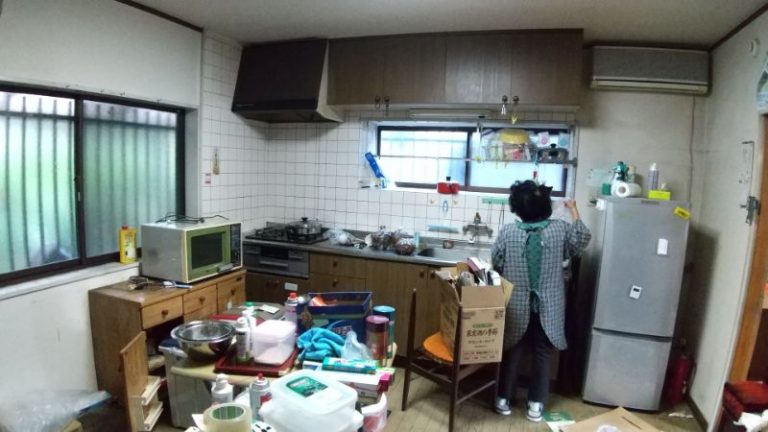
Locate an element on the screen. fridge is located at coordinates (637, 273).